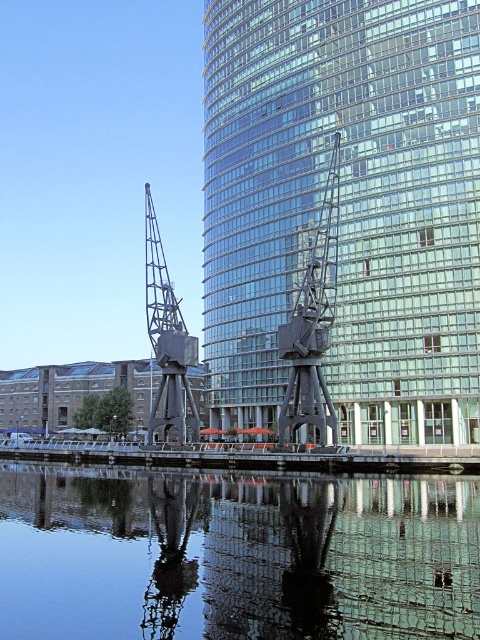
You are a drone operator trying to navigate between two points in the urban scene. The first point is at coordinates point (317,348) and the second is at point (149,412). According to the image, which point is closer to the observer?

Point (317,348) is in front of point (149,412), so it is closer to the observer.

You are a photographer standing at the edge of the water. You want to take a photo of the metallic industrial crane at center and the transparent glass water at center. According to the scene description, which object should you focus on first if you want to capture both in one frame?

The transparent glass water at center is positioned on the right side of metallic industrial crane at center. Since you are standing at the edge of the water, you should focus on the metallic industrial crane at center first as it is closer to your position, then adjust to include the transparent glass water at center on its right side in the frame.